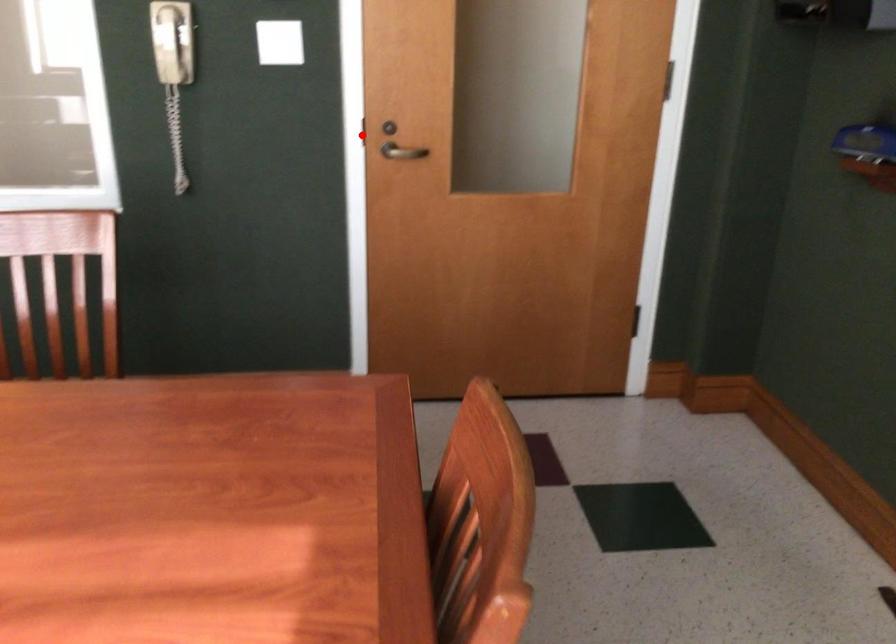
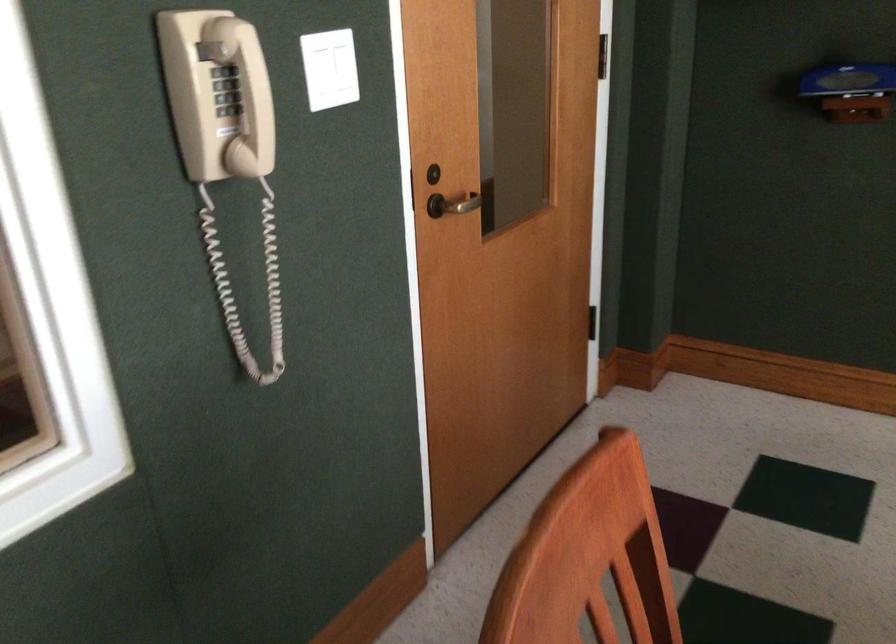
Find the pixel in the second image that matches the highlighted location in the first image.

(409, 191)